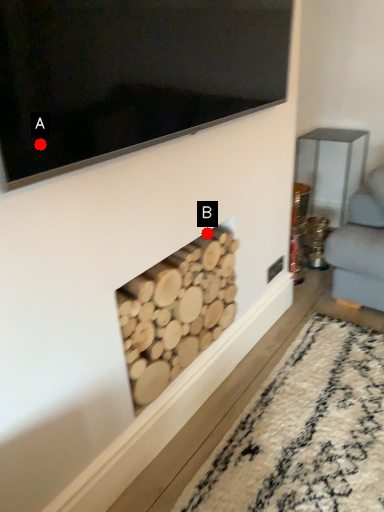
Question: Two points are circled on the image, labeled by A and B beside each circle. Which point is closer to the camera?

Choices:
 (A) A is closer
 (B) B is closer

Answer: (A)